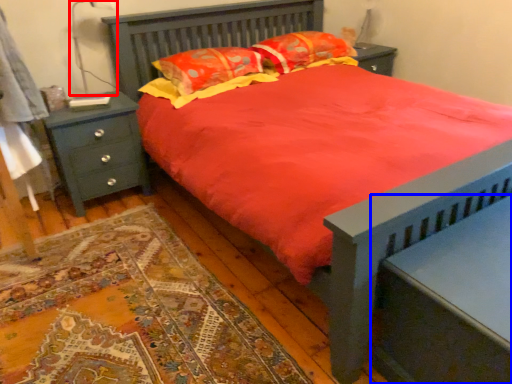
Question: Among these objects, which one is nearest to the camera, table lamp (highlighted by a red box) or nightstand (highlighted by a blue box)?

Choices:
 (A) table lamp
 (B) nightstand

Answer: (B)